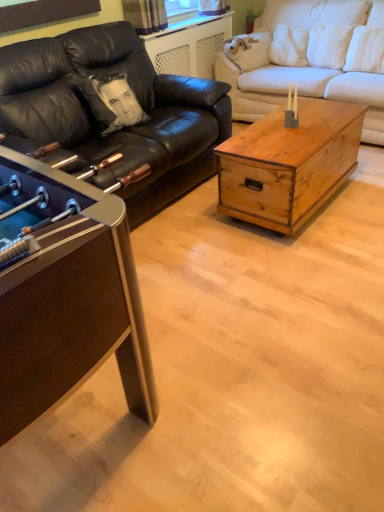
Question: From the image's perspective, does black leather couch at left, positioned as the first studio couch in left-to-right order, appear higher than white fabric couch at center, the 2th studio couch from the left?

Choices:
 (A) yes
 (B) no

Answer: (B)

Question: Does black leather couch at left, positioned as the first studio couch in left-to-right order, have a larger size compared to white fabric couch at center, the 2th studio couch from the left?

Choices:
 (A) no
 (B) yes

Answer: (B)

Question: Is black leather couch at left, arranged as the second studio couch when viewed from the right, not inside white fabric couch at center, which is counted as the 1th studio couch, starting from the right?

Choices:
 (A) no
 (B) yes

Answer: (B)

Question: Does black leather couch at left, arranged as the second studio couch when viewed from the right, have a lesser width compared to white fabric couch at center, which is counted as the 1th studio couch, starting from the right?

Choices:
 (A) no
 (B) yes

Answer: (A)

Question: Is the position of black leather couch at left, arranged as the second studio couch when viewed from the right, more distant than that of white fabric couch at center, the 2th studio couch from the left?

Choices:
 (A) yes
 (B) no

Answer: (B)

Question: Visually, is rustic wood trunk at center, which appears as the 1th coffee table when viewed from the right, positioned to the left or to the right of white satin pillow at upper right?

Choices:
 (A) right
 (B) left

Answer: (B)

Question: From the image's perspective, relative to white satin pillow at upper right, is rustic wood trunk at center, positioned as the second coffee table in left-to-right order, above or below?

Choices:
 (A) below
 (B) above

Answer: (A)

Question: Looking at their shapes, would you say rustic wood trunk at center, positioned as the second coffee table in left-to-right order, is wider or thinner than white satin pillow at upper right?

Choices:
 (A) wide
 (B) thin

Answer: (A)

Question: From a real-world perspective, is rustic wood trunk at center, which appears as the 1th coffee table when viewed from the right, positioned above or below white satin pillow at upper right?

Choices:
 (A) below
 (B) above

Answer: (A)

Question: From their relative heights in the image, would you say rustic wood trunk at center, which appears as the 1th coffee table when viewed from the right, is taller or shorter than metallic brown foosball table at left, which is the first coffee table from left to right?

Choices:
 (A) short
 (B) tall

Answer: (A)

Question: Is rustic wood trunk at center, which appears as the 1th coffee table when viewed from the right, bigger or smaller than metallic brown foosball table at left, which is the first coffee table from left to right?

Choices:
 (A) small
 (B) big

Answer: (A)

Question: Is rustic wood trunk at center, which appears as the 1th coffee table when viewed from the right, to the left or to the right of metallic brown foosball table at left, which is the first coffee table from left to right, in the image?

Choices:
 (A) right
 (B) left

Answer: (A)

Question: Choose the correct answer: Is rustic wood trunk at center, positioned as the second coffee table in left-to-right order, inside metallic brown foosball table at left, the second coffee table positioned from the right, or outside it?

Choices:
 (A) outside
 (B) inside

Answer: (A)

Question: Would you say metallic brown foosball table at left, the second coffee table positioned from the right, is inside or outside white fabric couch at center, the 2th studio couch from the left?

Choices:
 (A) outside
 (B) inside

Answer: (A)

Question: Considering their positions, is metallic brown foosball table at left, the second coffee table positioned from the right, located in front of or behind white fabric couch at center, the 2th studio couch from the left?

Choices:
 (A) behind
 (B) front

Answer: (B)